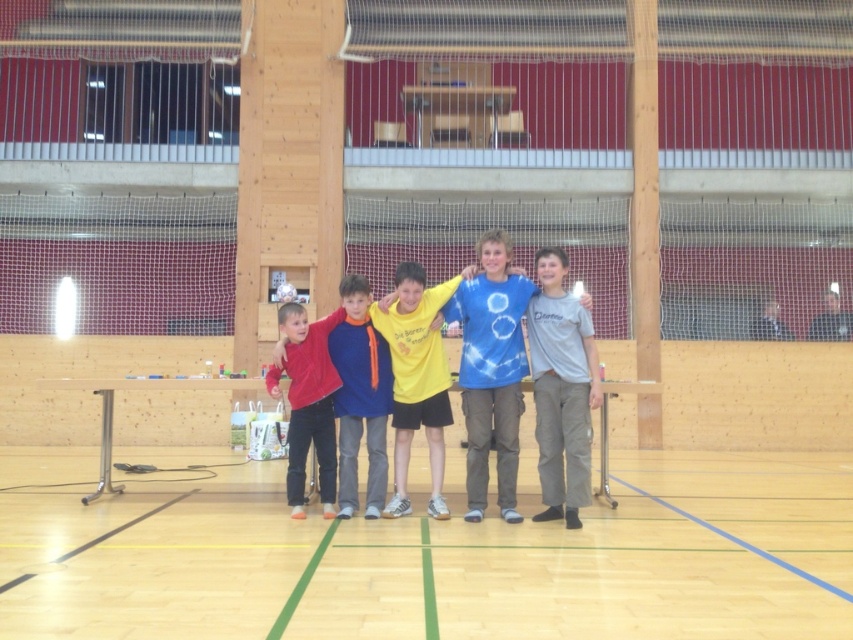
Based on the photo, you are a photographer setting up for a group photo. You need to ensure that the velvet red sweater at center and the dark gray shirt at right are both visible in the frame. Considering their heights, which one might you need to adjust the camera angle for to ensure both are fully visible?

The velvet red sweater at center is taller than the dark gray shirt at right. To ensure both are fully visible, you might lower the camera angle slightly to capture the taller velvet red sweater at center without cropping it, while still including the shorter dark gray shirt at right in the frame.